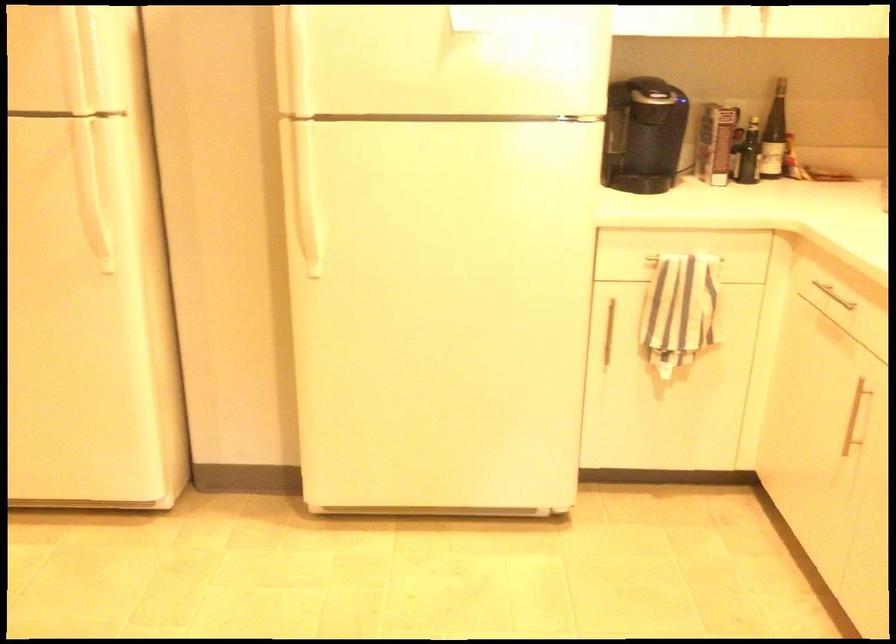
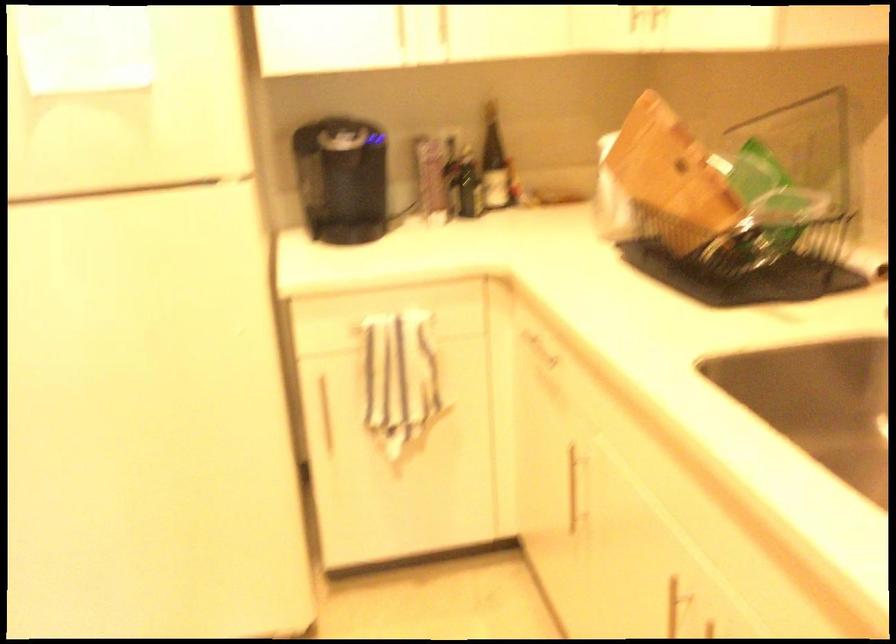
Find the pixel in the second image that matches (x=608, y=332) in the first image.

(323, 412)